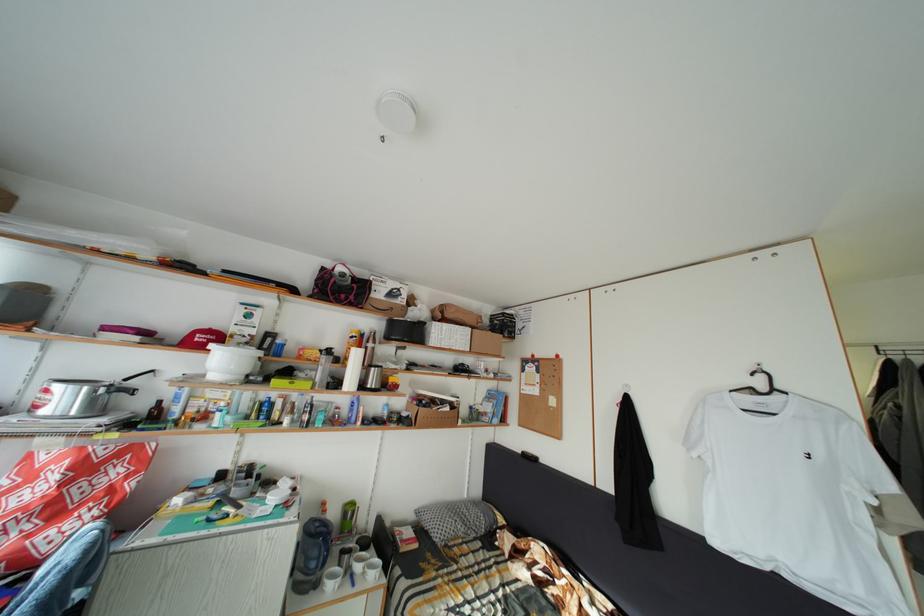
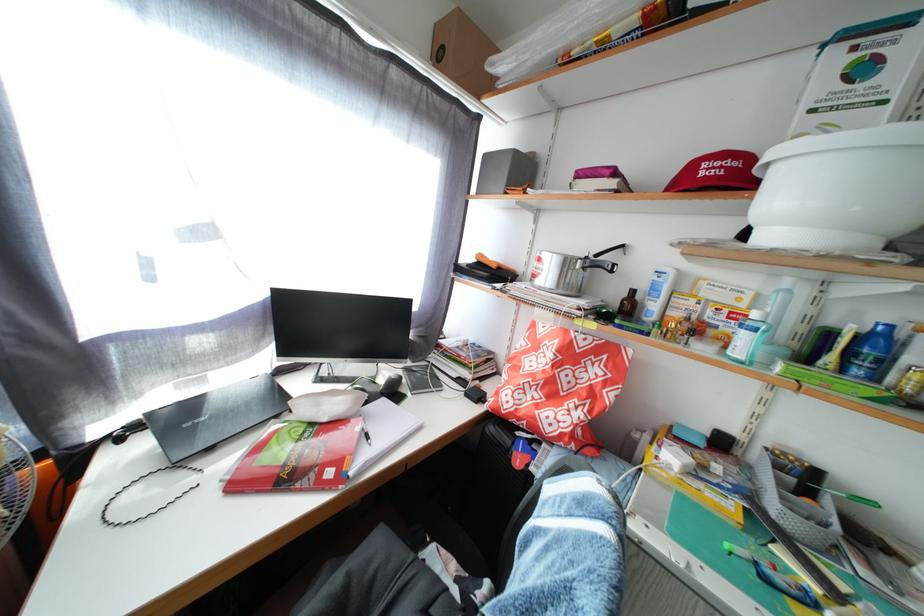
In the second image, find the point that corresponds to [112,459] in the first image.

(590, 350)